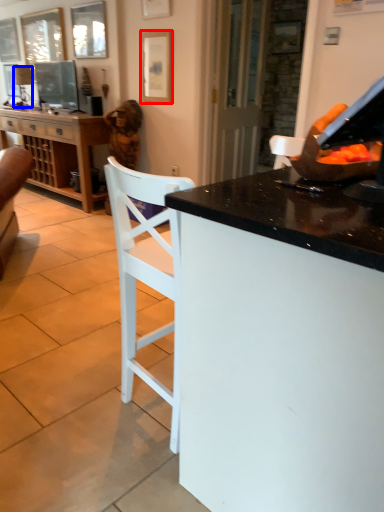
Question: Which object is further to the camera taking this photo, picture frame (highlighted by a red box) or lamp (highlighted by a blue box)?

Choices:
 (A) picture frame
 (B) lamp

Answer: (B)